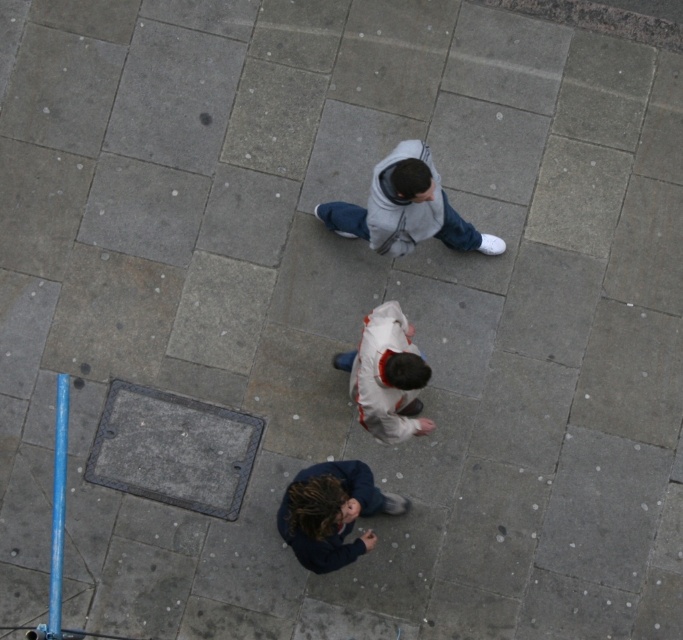
Between gray fleece jacket at upper center and white matte jacket at center, which one is positioned higher?

Positioned higher is gray fleece jacket at upper center.

In the scene shown: Which of these two, gray fleece jacket at upper center or white matte jacket at center, stands taller?

Standing taller between the two is white matte jacket at center.

Which is behind, point (372, 230) or point (350, 358)?

Point (350, 358)

I want to click on gray fleece jacket at upper center, so click(404, 209).

Does point (389, 212) lie in front of point (290, 515)?

No, (389, 212) is behind (290, 515).

Is point (378, 230) in front of point (301, 484)?

No, it is behind (301, 484).

The width and height of the screenshot is (683, 640). I want to click on gray fleece jacket at upper center, so click(404, 209).

Is dark blue fleece jacket at lower center bigger than white matte jacket at center?

Yes, dark blue fleece jacket at lower center is bigger than white matte jacket at center.

Who is higher up, dark blue fleece jacket at lower center or white matte jacket at center?

A: white matte jacket at center is above.

I want to click on dark blue fleece jacket at lower center, so click(331, 513).